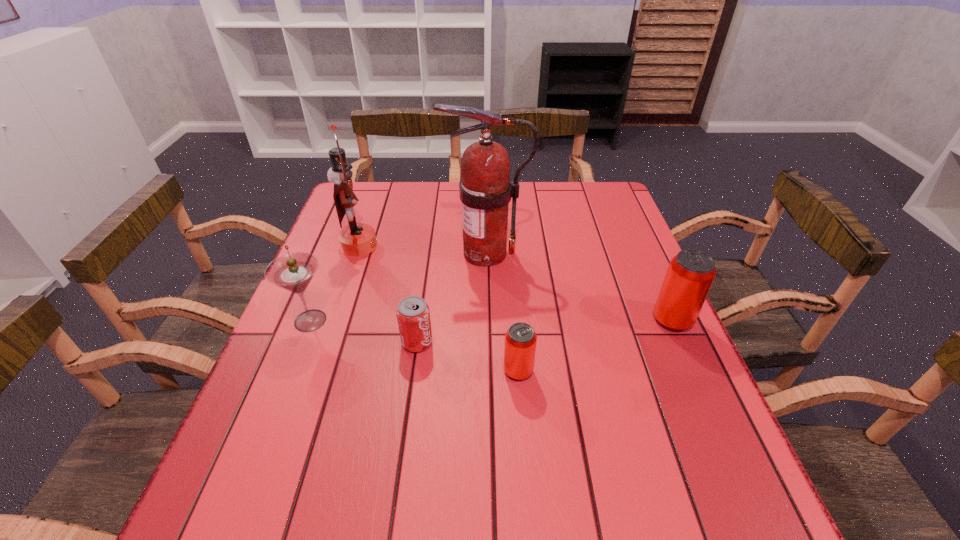
This screenshot has width=960, height=540. I want to click on vacant region at the near edge of the desktop, so click(x=379, y=458).

This screenshot has height=540, width=960. Find the location of `blank space at the left edge of the desktop`. blank space at the left edge of the desktop is located at coordinates (296, 370).

Locate an element on the screen. The height and width of the screenshot is (540, 960). vacant space at the right edge of the desktop is located at coordinates (588, 268).

Locate an element on the screen. The width and height of the screenshot is (960, 540). vacant space at the far left corner of the desktop is located at coordinates (389, 206).

The height and width of the screenshot is (540, 960). In the image, there is a desktop. In order to click on blank space at the far right corner in this screenshot , I will do `click(622, 216)`.

Where is `blank region between the fourth object from right to left and the nutcracker`? blank region between the fourth object from right to left and the nutcracker is located at coordinates (388, 294).

Identify the location of free space between the shorter can and the right can. (595, 345).

Find the location of a particular element. This screenshot has width=960, height=540. vacant space that's between the nutcracker and the rightmost object is located at coordinates (516, 283).

You are a GUI agent. You are given a task and a screenshot of the screen. Output one action in this format:
    pyautogui.click(x=<x>, y=<y>)
    Task: Click on the free spot between the fire extinguisher and the nearer can
    The height and width of the screenshot is (540, 960).
    Given the screenshot: What is the action you would take?
    pyautogui.click(x=502, y=312)

The width and height of the screenshot is (960, 540). In order to click on vacant area that lies between the soda can and the nutcracker in this screenshot , I will do `click(388, 294)`.